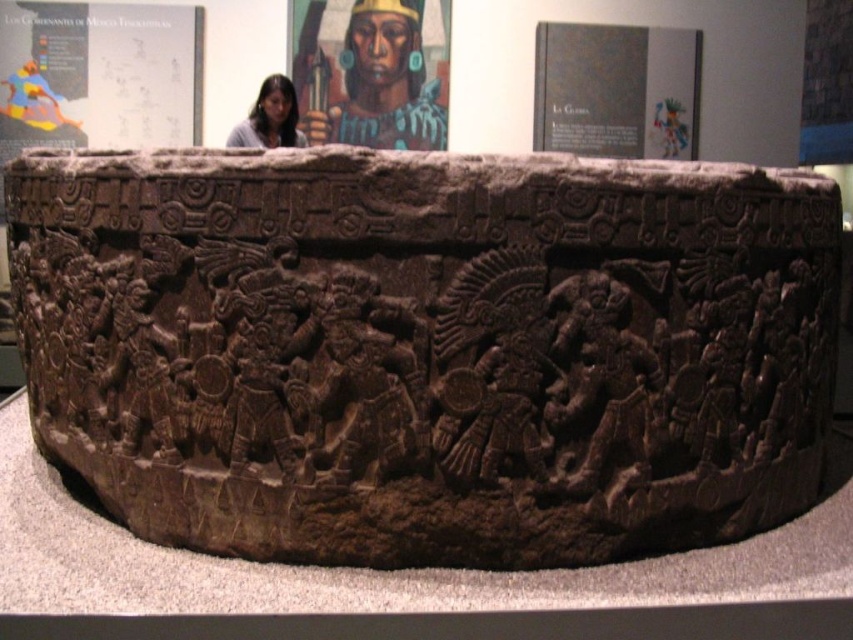
Question: Which of these objects is positioned farthest from the smooth skin face at upper center?

Choices:
 (A) brown carved stone at center
 (B) matte brown face at upper center

Answer: (A)

Question: Does brown carved stone at center have a greater width compared to matte brown face at upper center?

Choices:
 (A) no
 (B) yes

Answer: (B)

Question: Is brown carved stone at center positioned in front of matte brown face at upper center?

Choices:
 (A) no
 (B) yes

Answer: (B)

Question: Which point is farther from the camera taking this photo?

Choices:
 (A) (299, 131)
 (B) (389, 72)

Answer: (B)

Question: Which of the following is the closest to the observer?

Choices:
 (A) brown carved stone at center
 (B) smooth skin face at upper center

Answer: (A)

Question: Does brown carved stone at center have a lesser width compared to smooth skin face at upper center?

Choices:
 (A) no
 (B) yes

Answer: (A)